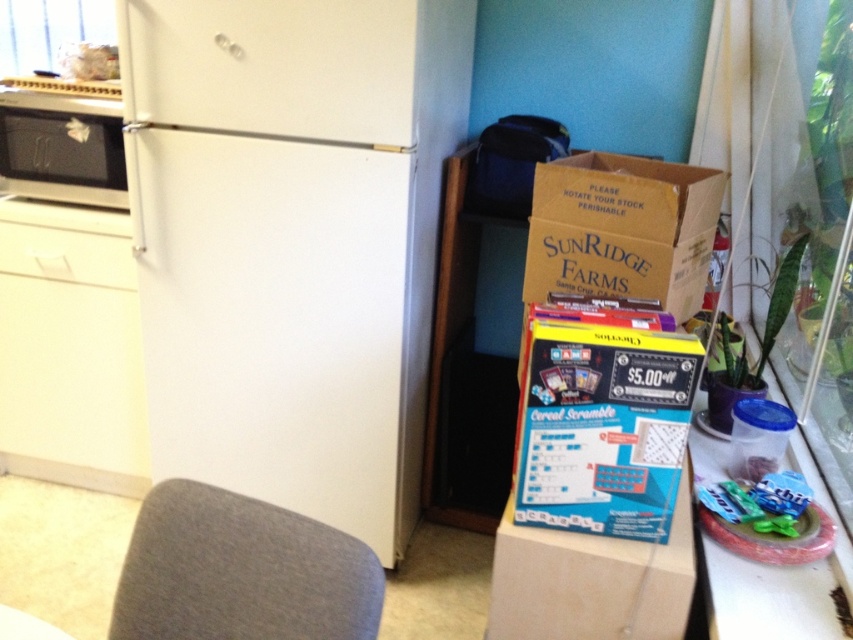
Question: Which object is the closest to the clear plastic container at lower right?

Choices:
 (A) matte black microwave at left
 (B) gray fabric chair at lower left

Answer: (B)

Question: Is gray fabric chair at lower left below clear plastic container at lower right?

Choices:
 (A) no
 (B) yes

Answer: (A)

Question: Is white matte refrigerator at left bigger than gray fabric chair at lower left?

Choices:
 (A) no
 (B) yes

Answer: (B)

Question: Which object appears farthest from the camera in this image?

Choices:
 (A) clear plastic container at lower right
 (B) white matte refrigerator at left

Answer: (B)

Question: Based on their relative distances, which object is farther from the gray fabric chair at lower left?

Choices:
 (A) clear plastic container at lower right
 (B) white matte refrigerator at left
 (C) matte black microwave at left

Answer: (C)

Question: Is gray fabric chair at lower left below matte black microwave at left?

Choices:
 (A) no
 (B) yes

Answer: (B)